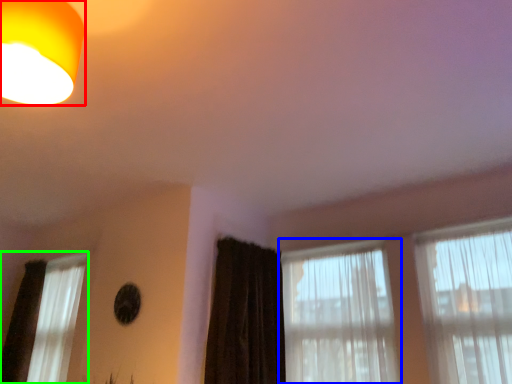
Question: Which object is the farthest from lamp (highlighted by a red box)? Choose among these: window (highlighted by a blue box) or window (highlighted by a green box).

Choices:
 (A) window
 (B) window

Answer: (B)